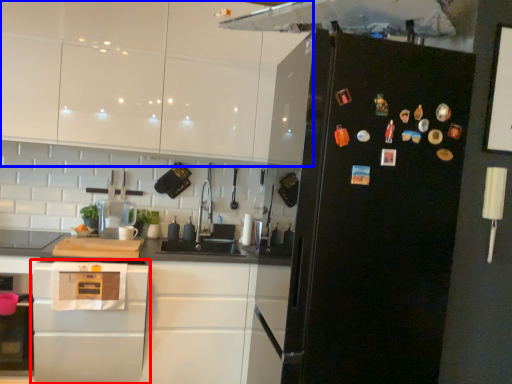
Question: Which point is further to the camera, home appliance (highlighted by a red box) or cabinetry (highlighted by a blue box)?

Choices:
 (A) home appliance
 (B) cabinetry

Answer: (B)